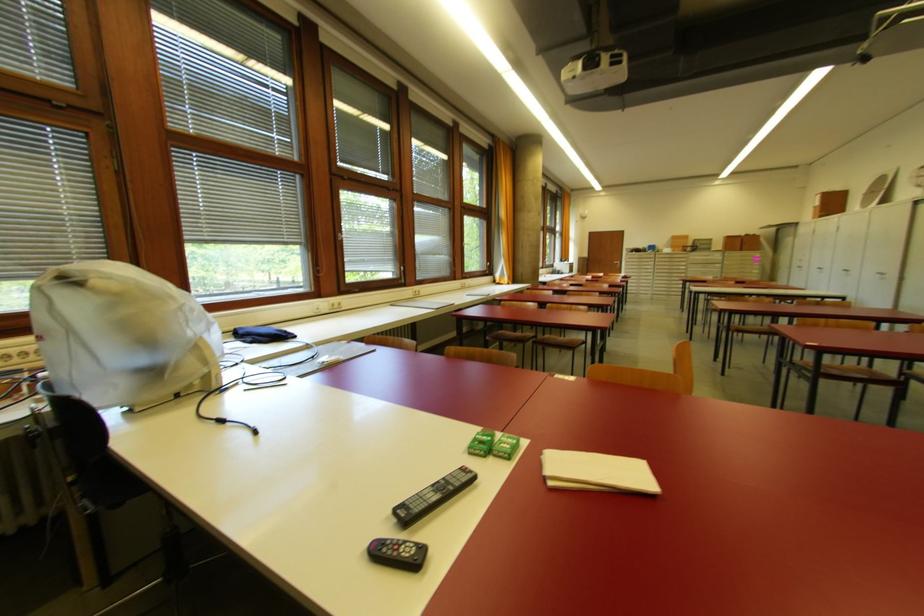
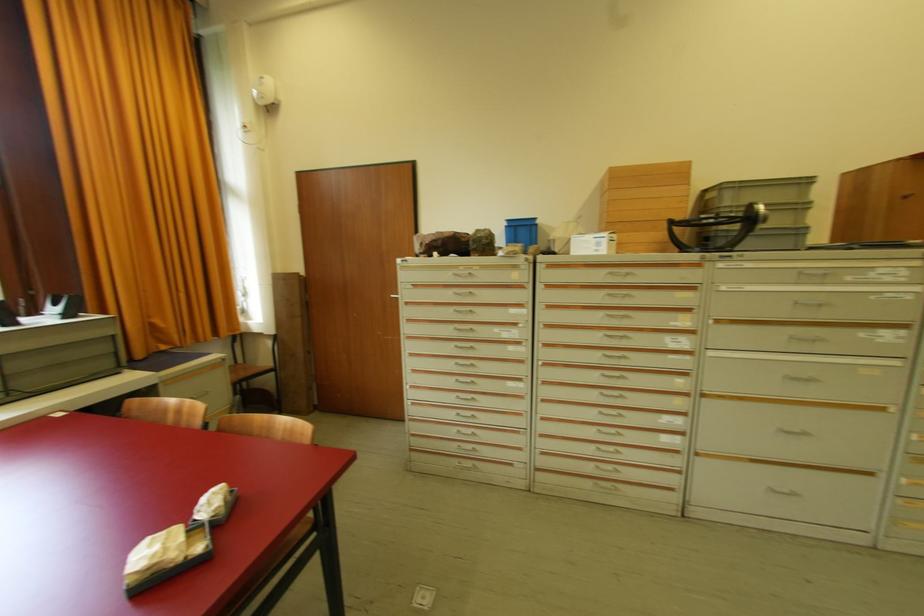
Locate, in the second image, the point that corresponds to point (713, 241) in the first image.

(809, 184)